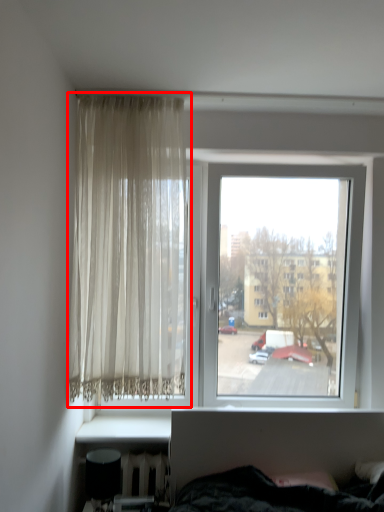
Question: Considering the relative positions of curtain (annotated by the red box) and window in the image provided, where is curtain (annotated by the red box) located with respect to the staircase?

Choices:
 (A) right
 (B) left

Answer: (B)